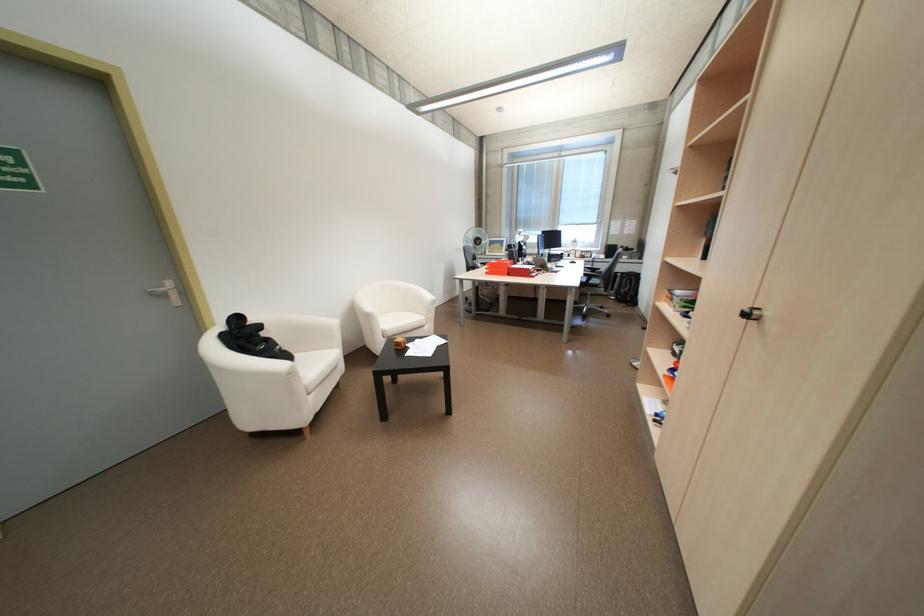
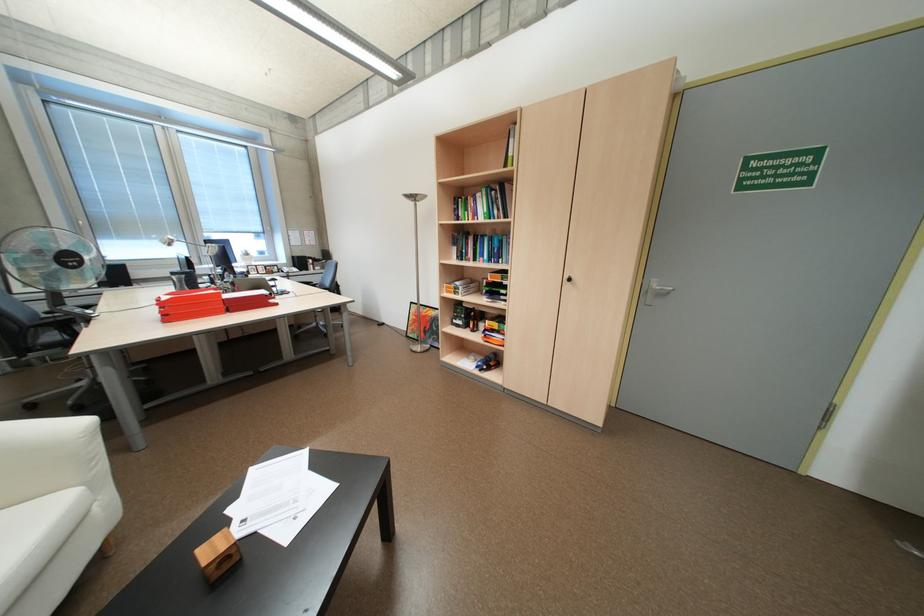
The point at (684, 353) is marked in the first image. Where is the corresponding point in the second image?

(468, 325)